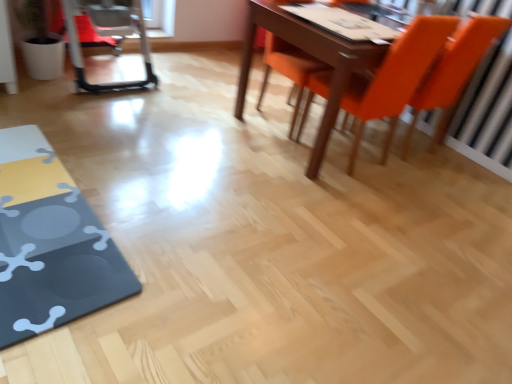
Identify the location of spots to the right of orange matte chair at upper right, the 2th chair positioned from the right. The width and height of the screenshot is (512, 384). (429, 182).